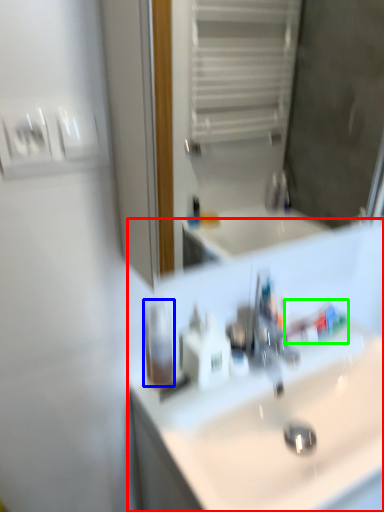
Question: Considering the real-world distances, which object is farthest from sink (highlighted by a red box)? mouthwash (highlighted by a blue box) or toothpaste (highlighted by a green box)?

Choices:
 (A) mouthwash
 (B) toothpaste

Answer: (A)